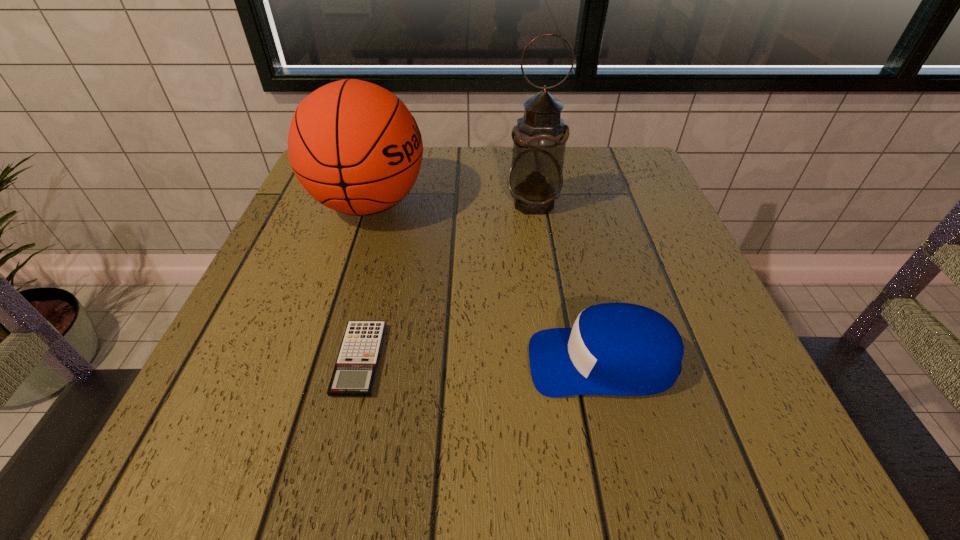
This screenshot has height=540, width=960. What are the coordinates of `free space between the calculator and the third tallest object` in the screenshot? It's located at (481, 360).

This screenshot has width=960, height=540. I want to click on vacant space that is in between the oil lamp and the baseball cap, so click(x=568, y=282).

Locate which object is the closest to the second tallest object. Please provide its 2D coordinates. Your answer should be formatted as a tuple, i.e. [(x, y)], where the tuple contains the x and y coordinates of a point satisfying the conditions above.

[(535, 179)]

You are a GUI agent. You are given a task and a screenshot of the screen. Output one action in this format:
    pyautogui.click(x=<x>, y=<y>)
    Task: Click on the third closest object to the tallest object
    The height and width of the screenshot is (540, 960).
    Given the screenshot: What is the action you would take?
    pos(354,374)

Identify the location of free space that satisfies the following two spatial constraints: 1. on the side with logo of the calculator; 2. on the left side of the basketball. This screenshot has height=540, width=960. (320, 359).

At what (x,y) coordinates should I click in order to perform the action: click on blank area in the image that satisfies the following two spatial constraints: 1. on the back side of the shortest object; 2. on the side with logo of the second tallest object. Please return your answer as a coordinate pair (x, y). Image resolution: width=960 pixels, height=540 pixels. Looking at the image, I should click on (396, 204).